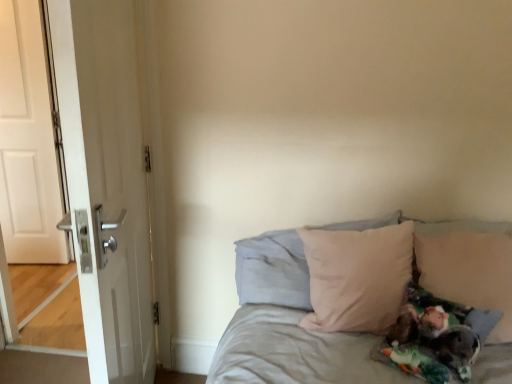
The image size is (512, 384). Find the location of `white glossy door at left, the 1th door viewed from the right`. white glossy door at left, the 1th door viewed from the right is located at coordinates coord(106,182).

The height and width of the screenshot is (384, 512). I want to click on white matte door at left, the second door when ordered from front to back, so click(x=28, y=141).

Which is in front, beige fabric bed at center or beige fabric pillow at right, the second pillow when ordered from left to right?

beige fabric bed at center is closer to the camera.

Does beige fabric bed at center have a lesser height compared to beige fabric pillow at right, arranged as the 1th pillow when viewed from the right?

No.

From a real-world perspective, is beige fabric bed at center above or below beige fabric pillow at right, arranged as the 1th pillow when viewed from the right?

Clearly, from a real-world perspective, beige fabric bed at center is below beige fabric pillow at right, arranged as the 1th pillow when viewed from the right.

Is beige fabric bed at center wider or thinner than beige fabric pillow at right, arranged as the 1th pillow when viewed from the right?

Clearly, beige fabric bed at center has less width compared to beige fabric pillow at right, arranged as the 1th pillow when viewed from the right.

Looking at this image, is beige fabric bed at center oriented away from white matte door at left, the first door positioned from the back?

beige fabric bed at center does not have its back to white matte door at left, the first door positioned from the back.

Looking at this image, between beige fabric bed at center and white matte door at left, the second door when ordered from front to back, which one has more height?

With more height is white matte door at left, the second door when ordered from front to back.

From the image's perspective, which is above, beige fabric bed at center or white matte door at left, the second door when ordered from front to back?

white matte door at left, the second door when ordered from front to back, from the image's perspective.

Is point (283, 312) in front of point (58, 219)?

Yes, point (283, 312) is in front of point (58, 219).

Is white glossy door at left, which appears as the 2th door when viewed from the back, turned away from white matte door at left, the first door positioned from the back?

No, white matte door at left, the first door positioned from the back, is not at the back of white glossy door at left, which appears as the 2th door when viewed from the back.

Is white glossy door at left, the 1th door viewed from the right, in front of or behind white matte door at left, the first door positioned from the back, in the image?

white glossy door at left, the 1th door viewed from the right, is in front of white matte door at left, the first door positioned from the back.

Measure the distance between white glossy door at left, which is the second door in left-to-right order, and white matte door at left, the second door when ordered from front to back.

white glossy door at left, which is the second door in left-to-right order, and white matte door at left, the second door when ordered from front to back, are 1.60 meters apart.

Considering the sizes of white glossy door at left, which is the second door in left-to-right order, and white matte door at left, placed as the 1th door when sorted from left to right, in the image, is white glossy door at left, which is the second door in left-to-right order, bigger or smaller than white matte door at left, placed as the 1th door when sorted from left to right,?

Considering their sizes, white glossy door at left, which is the second door in left-to-right order, takes up more space than white matte door at left, placed as the 1th door when sorted from left to right.

Considering the positions of objects white matte door at left, placed as the 1th door when sorted from left to right, and beige fabric bed at center in the image provided, who is behind, white matte door at left, placed as the 1th door when sorted from left to right, or beige fabric bed at center?

white matte door at left, placed as the 1th door when sorted from left to right, is further away from the camera.

Which object is positioned more to the right, white matte door at left, the first door positioned from the back, or beige fabric bed at center?

Positioned to the right is beige fabric bed at center.

Considering the sizes of objects white matte door at left, the second door when ordered from front to back, and beige fabric bed at center in the image provided, who is taller, white matte door at left, the second door when ordered from front to back, or beige fabric bed at center?

With more height is white matte door at left, the second door when ordered from front to back.

Is point (17, 98) positioned behind point (261, 367)?

Yes, it is.

Does point (275, 346) lie behind point (263, 283)?

No, it is in front of (263, 283).

Can you confirm if beige fabric bed at center is shorter than beige fabric pillow at center, arranged as the 2th pillow when viewed from the right?

In fact, beige fabric bed at center may be taller than beige fabric pillow at center, arranged as the 2th pillow when viewed from the right.

From the beige fabric bed at center, count 2nd pillows backward and point to it. Please provide its 2D coordinates.

[(273, 270)]

Based on the photo, would you say white matte door at left, the second door from the right, is a long distance from beige fabric pillow at center, arranged as the 2th pillow when viewed from the right?

Yes, white matte door at left, the second door from the right, is far from beige fabric pillow at center, arranged as the 2th pillow when viewed from the right.

Considering the relative sizes of white matte door at left, the first door positioned from the back, and beige fabric pillow at center, the 1th pillow in the left-to-right sequence, in the image provided, is white matte door at left, the first door positioned from the back, taller than beige fabric pillow at center, the 1th pillow in the left-to-right sequence,?

Correct, white matte door at left, the first door positioned from the back, is much taller as beige fabric pillow at center, the 1th pillow in the left-to-right sequence.

Considering the points (22, 141) and (258, 300), which point is in front, point (22, 141) or point (258, 300)?

Positioned in front is point (258, 300).

Is white matte door at left, the first door positioned from the back, positioned beyond the bounds of beige fabric pillow at center, the 1th pillow in the left-to-right sequence?

white matte door at left, the first door positioned from the back, lies outside beige fabric pillow at center, the 1th pillow in the left-to-right sequence,'s area.

Is white glossy door at left, the 1th door viewed from the front, aimed at beige fabric pillow at right, the second pillow when ordered from left to right?

No, white glossy door at left, the 1th door viewed from the front, is not aimed at beige fabric pillow at right, the second pillow when ordered from left to right.

Is white glossy door at left, which is the second door in left-to-right order, positioned far away from beige fabric pillow at right, the second pillow when ordered from left to right?

white glossy door at left, which is the second door in left-to-right order, is far away from beige fabric pillow at right, the second pillow when ordered from left to right.

How different are the orientations of white glossy door at left, the 1th door viewed from the right, and beige fabric pillow at right, arranged as the 1th pillow when viewed from the right, in degrees?

165 degrees separate the facing orientations of white glossy door at left, the 1th door viewed from the right, and beige fabric pillow at right, arranged as the 1th pillow when viewed from the right.

Image resolution: width=512 pixels, height=384 pixels. I want to click on pillow on the right of beige fabric bed at center, so click(468, 266).

Locate an element on the screen. bed below the white matte door at left, the second door from the right (from a real-world perspective) is located at coordinates (294, 352).

Based on their spatial positions, is beige fabric pillow at right, arranged as the 1th pillow when viewed from the right, or white glossy door at left, the 1th door viewed from the right, closer to beige fabric pillow at center, the 1th pillow in the left-to-right sequence?

beige fabric pillow at right, arranged as the 1th pillow when viewed from the right, is positioned closer to the anchor beige fabric pillow at center, the 1th pillow in the left-to-right sequence.

From the image, which object appears to be farther from white glossy door at left, the 1th door viewed from the front, beige fabric pillow at right, the second pillow when ordered from left to right, or beige fabric pillow at center, arranged as the 2th pillow when viewed from the right?

beige fabric pillow at right, the second pillow when ordered from left to right, is positioned further to the anchor white glossy door at left, the 1th door viewed from the front.

From the image, which object appears to be nearer to beige fabric pillow at center, the 1th pillow in the left-to-right sequence, beige fabric bed at center or beige fabric pillow at right, the second pillow when ordered from left to right?

beige fabric bed at center.

Estimate the real-world distances between objects in this image. Which object is closer to beige fabric bed at center, beige fabric pillow at right, arranged as the 1th pillow when viewed from the right, or white matte door at left, the first door positioned from the back?

beige fabric pillow at right, arranged as the 1th pillow when viewed from the right, lies closer to beige fabric bed at center than the other object.

Estimate the real-world distances between objects in this image. Which object is further from beige fabric pillow at center, arranged as the 2th pillow when viewed from the right, white glossy door at left, which appears as the 2th door when viewed from the back, or beige fabric bed at center?

Based on the image, white glossy door at left, which appears as the 2th door when viewed from the back, appears to be further to beige fabric pillow at center, arranged as the 2th pillow when viewed from the right.

From the image, which object appears to be farther from beige fabric pillow at right, arranged as the 1th pillow when viewed from the right, beige fabric pillow at center, arranged as the 2th pillow when viewed from the right, or white matte door at left, the first door positioned from the back?

Among the two, white matte door at left, the first door positioned from the back, is located further to beige fabric pillow at right, arranged as the 1th pillow when viewed from the right.

Looking at this image, looking at the image, which one is located further to beige fabric pillow at right, arranged as the 1th pillow when viewed from the right, beige fabric pillow at center, arranged as the 2th pillow when viewed from the right, or white glossy door at left, the 1th door viewed from the front?

Based on the image, white glossy door at left, the 1th door viewed from the front, appears to be further to beige fabric pillow at right, arranged as the 1th pillow when viewed from the right.

Estimate the real-world distances between objects in this image. Which object is further from beige fabric pillow at center, arranged as the 2th pillow when viewed from the right, beige fabric pillow at right, arranged as the 1th pillow when viewed from the right, or white matte door at left, the second door from the right?

Among the two, white matte door at left, the second door from the right, is located further to beige fabric pillow at center, arranged as the 2th pillow when viewed from the right.

Locate an element on the screen. The width and height of the screenshot is (512, 384). pillow between white glossy door at left, the 1th door viewed from the front, and beige fabric bed at center, in the horizontal direction is located at coordinates (273, 270).

You are a GUI agent. You are given a task and a screenshot of the screen. Output one action in this format:
    pyautogui.click(x=<x>, y=<y>)
    Task: Click on the pillow located between white matte door at left, the second door when ordered from front to back, and beige fabric pillow at right, arranged as the 1th pillow when viewed from the right, in the left-right direction
    
    Given the screenshot: What is the action you would take?
    pyautogui.click(x=273, y=270)

At what (x,y) coordinates should I click in order to perform the action: click on bed situated between white glossy door at left, the 1th door viewed from the right, and beige fabric pillow at right, the second pillow when ordered from left to right, from left to right. Please return your answer as a coordinate pair (x, y). This screenshot has height=384, width=512. Looking at the image, I should click on (294, 352).

You are a GUI agent. You are given a task and a screenshot of the screen. Output one action in this format:
    pyautogui.click(x=<x>, y=<y>)
    Task: Click on the bed located between beige fabric pillow at center, arranged as the 2th pillow when viewed from the right, and beige fabric pillow at right, arranged as the 1th pillow when viewed from the right, in the left-right direction
    The width and height of the screenshot is (512, 384).
    Given the screenshot: What is the action you would take?
    pyautogui.click(x=294, y=352)